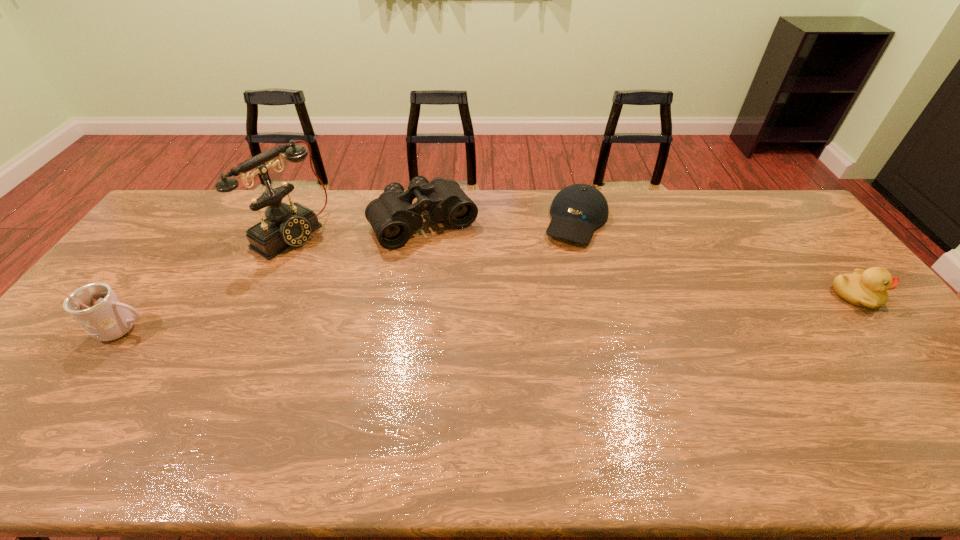
The image size is (960, 540). I want to click on blank space located 0.060m at the eyepieces of the third object from left to right, so click(453, 262).

This screenshot has height=540, width=960. What are the coordinates of `free location located at the eyepieces of the third object from left to right` in the screenshot? It's located at (468, 282).

Find the location of a particular element. free space located 0.100m at the eyepieces of the third object from left to right is located at coordinates (459, 270).

Image resolution: width=960 pixels, height=540 pixels. Identify the location of free location located 0.110m on the dial of the telephone. (332, 262).

This screenshot has width=960, height=540. Find the location of `vacant space located 0.150m on the dial of the telephone`. vacant space located 0.150m on the dial of the telephone is located at coordinates (341, 268).

I want to click on vacant space situated on the dial of the telephone, so click(329, 261).

You are a GUI agent. You are given a task and a screenshot of the screen. Output one action in this format:
    pyautogui.click(x=<x>, y=<y>)
    Task: Click on the free region located 0.340m on the front-facing side of the baseball cap
    This screenshot has height=540, width=960.
    Given the screenshot: What is the action you would take?
    539,323

Where is `free space located 0.340m on the front-facing side of the baseball cap`? free space located 0.340m on the front-facing side of the baseball cap is located at coordinates (539, 323).

At what (x,y) coordinates should I click in order to perform the action: click on vacant area situated 0.130m on the front-facing side of the baseball cap. Please return your answer as a coordinate pair (x, y). The image size is (960, 540). Looking at the image, I should click on pos(559,273).

Locate an element on the screen. binoculars that is at the far edge is located at coordinates (393, 217).